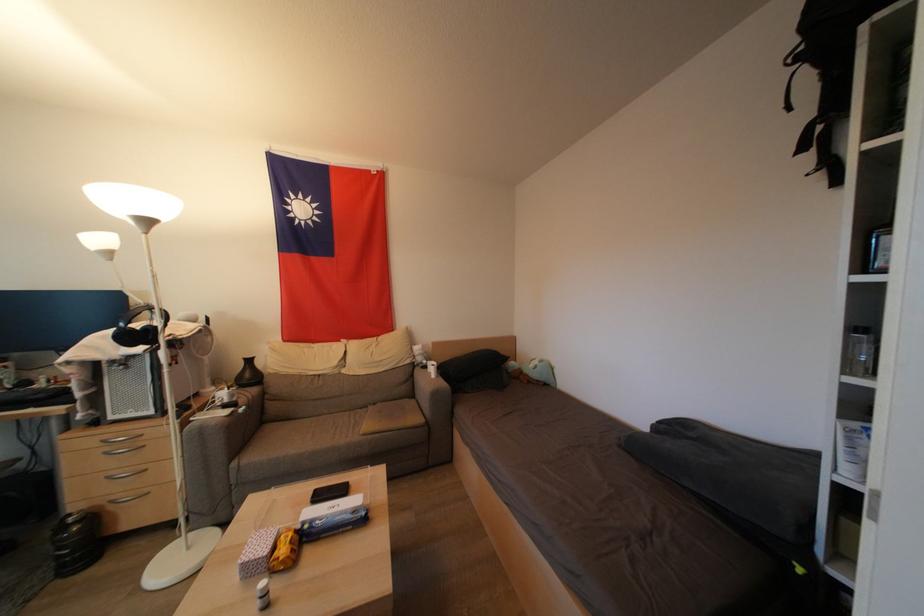
Identify the location of sofa sitting surface. (344, 432).